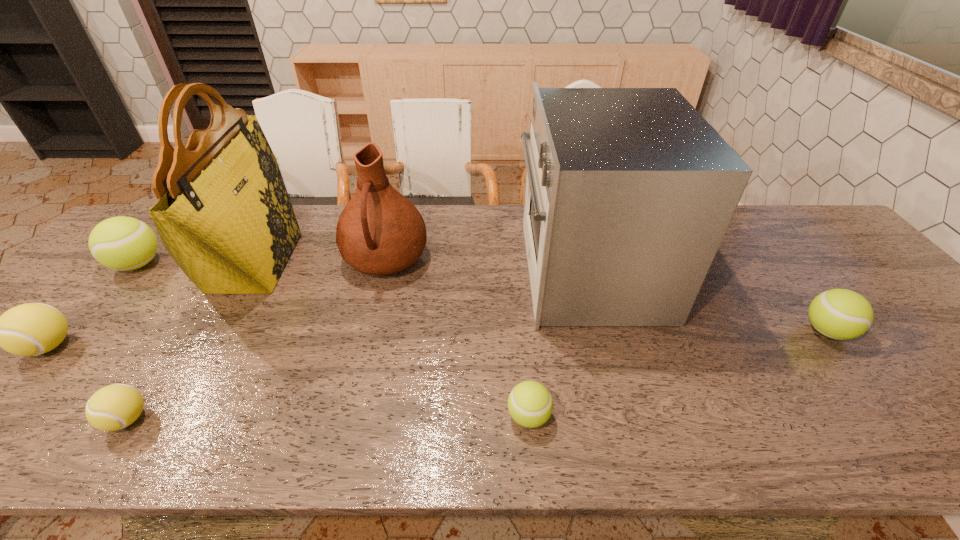
At what (x,y) coordinates should I click in order to perform the action: click on tote bag. Please return your answer as a coordinate pair (x, y). Looking at the image, I should click on [224, 215].

Image resolution: width=960 pixels, height=540 pixels. I want to click on toaster oven, so click(x=629, y=192).

Locate an element on the screen. The height and width of the screenshot is (540, 960). the third tallest object is located at coordinates [x=380, y=232].

Locate an element on the screen. the fifth object from left to right is located at coordinates (380, 232).

What are the coordinates of `the biggest green tennis ball` in the screenshot? It's located at (122, 243).

Identify the location of the leftmost green tennis ball. (122, 243).

I want to click on the left yellow tennis ball, so click(31, 329).

Locate an element on the screen. This screenshot has height=540, width=960. the farther yellow tennis ball is located at coordinates (31, 329).

Where is `the rightmost object`? The height and width of the screenshot is (540, 960). the rightmost object is located at coordinates (841, 314).

You are a GUI agent. You are given a task and a screenshot of the screen. Output one action in this format:
    pyautogui.click(x=<x>, y=<y>)
    Task: Click on the rightmost tennis ball
    
    Given the screenshot: What is the action you would take?
    pyautogui.click(x=841, y=314)